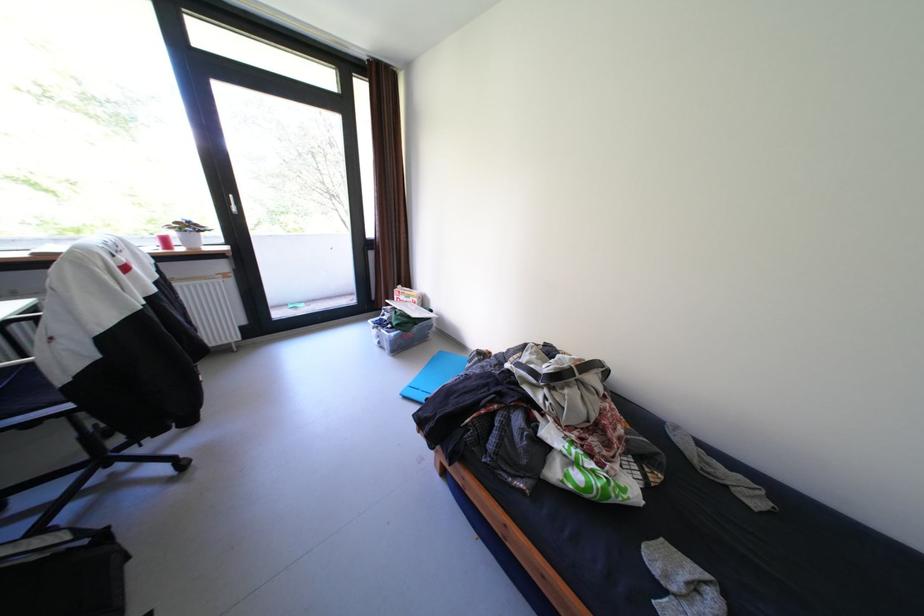
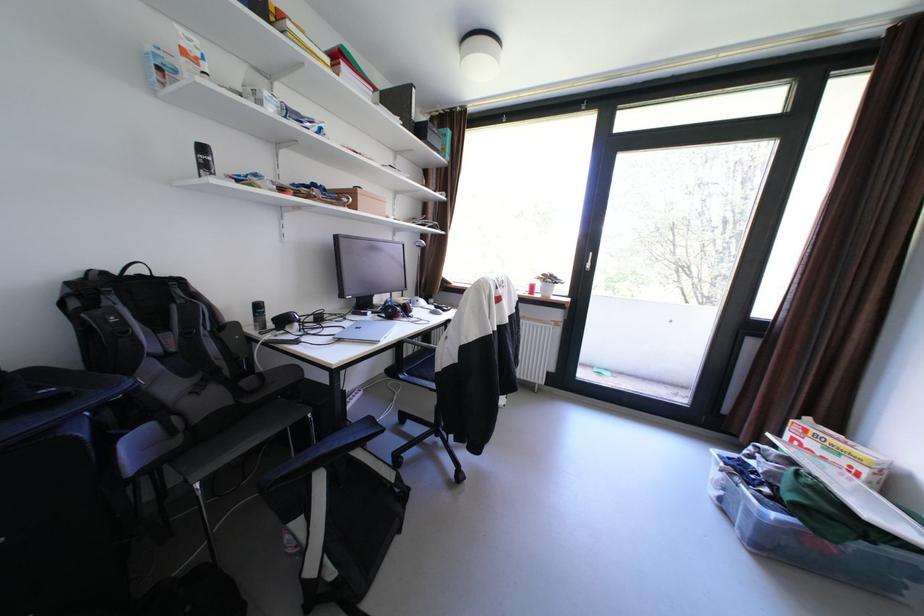
Question: The first image is from the beginning of the video and the second image is from the end. How did the camera likely rotate when shooting the video?

Choices:
 (A) Left
 (B) Right
 (C) Up
 (D) Down

Answer: (A)